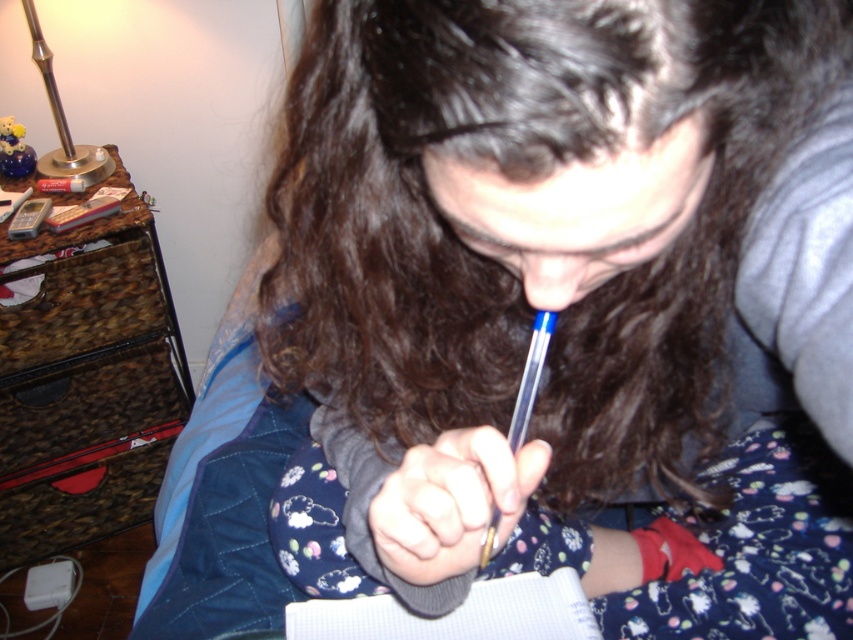
Measure the distance between metallic blue pen at center and camera.

metallic blue pen at center and camera are 10.20 inches apart.

Does point (332, 529) come behind point (93, 472)?

No.

Describe the element at coordinates (560, 305) in the screenshot. This screenshot has height=640, width=853. I see `metallic blue pen at center` at that location.

The height and width of the screenshot is (640, 853). I want to click on metallic blue pen at center, so click(560, 305).

Measure the distance from brown marble dresser at left to brown marble drawer at left.

A distance of 3.86 inches exists between brown marble dresser at left and brown marble drawer at left.

Is point (167, 348) positioned behind point (15, 337)?

Yes, it is.

Is point (82, 301) farther from viewer compared to point (91, 296)?

No, it is in front of (91, 296).

Where is `brown marble dresser at left`? brown marble dresser at left is located at coordinates (86, 387).

Who is higher up, brown marble dresser at left or white paper notebook at center?

brown marble dresser at left is above.

Which is more to the left, brown marble dresser at left or white paper notebook at center?

brown marble dresser at left is more to the left.

Is point (38, 538) behind point (575, 612)?

Yes, it is behind point (575, 612).

Identify the location of brown marble dresser at left. (86, 387).